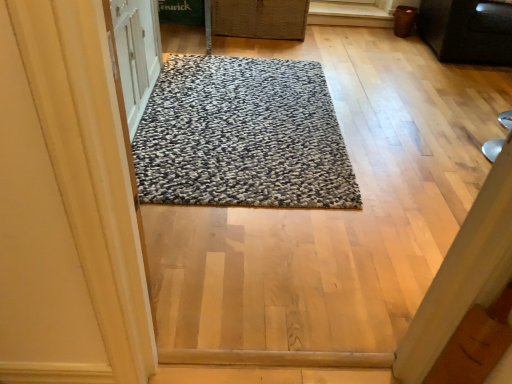
Question: From the image's perspective, is black matte cabinet at upper right located above textured gray rug at center?

Choices:
 (A) yes
 (B) no

Answer: (A)

Question: Can you confirm if black matte cabinet at upper right is positioned to the left of textured gray rug at center?

Choices:
 (A) yes
 (B) no

Answer: (B)

Question: Does black matte cabinet at upper right have a greater width compared to textured gray rug at center?

Choices:
 (A) yes
 (B) no

Answer: (B)

Question: Is black matte cabinet at upper right further to camera compared to textured gray rug at center?

Choices:
 (A) no
 (B) yes

Answer: (B)

Question: From a real-world perspective, is black matte cabinet at upper right beneath textured gray rug at center?

Choices:
 (A) no
 (B) yes

Answer: (A)

Question: From a real-world perspective, does black matte cabinet at upper right stand above textured gray rug at center?

Choices:
 (A) no
 (B) yes

Answer: (B)

Question: Is woven brown basket at upper center thinner than black matte cabinet at upper right?

Choices:
 (A) yes
 (B) no

Answer: (A)

Question: Can you confirm if woven brown basket at upper center is wider than black matte cabinet at upper right?

Choices:
 (A) no
 (B) yes

Answer: (A)

Question: Are woven brown basket at upper center and black matte cabinet at upper right located far from each other?

Choices:
 (A) no
 (B) yes

Answer: (B)

Question: From a real-world perspective, is woven brown basket at upper center positioned over black matte cabinet at upper right based on gravity?

Choices:
 (A) no
 (B) yes

Answer: (A)

Question: Considering the relative positions of woven brown basket at upper center and black matte cabinet at upper right in the image provided, is woven brown basket at upper center to the right of black matte cabinet at upper right from the viewer's perspective?

Choices:
 (A) yes
 (B) no

Answer: (B)

Question: Is woven brown basket at upper center smaller than black matte cabinet at upper right?

Choices:
 (A) yes
 (B) no

Answer: (A)

Question: Considering the relative sizes of textured gray rug at center and black matte cabinet at upper right in the image provided, is textured gray rug at center thinner than black matte cabinet at upper right?

Choices:
 (A) no
 (B) yes

Answer: (A)